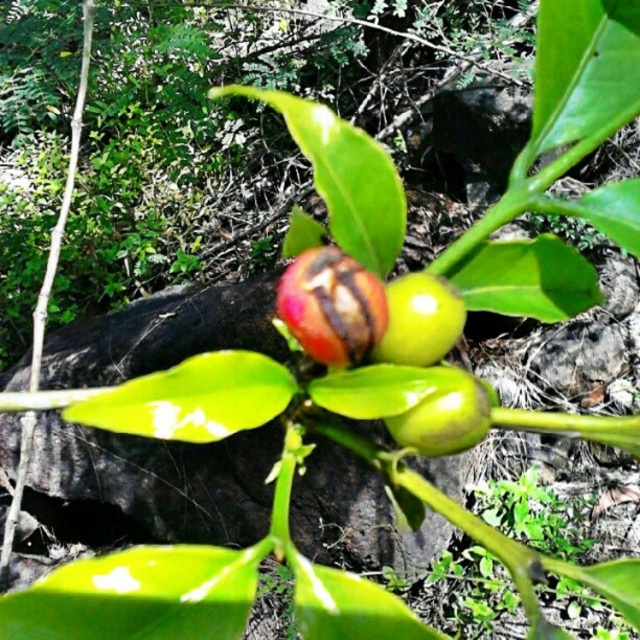
You are a botanist examining the plant and want to collect the shiny red fruit at center and the green glossy fruit at center. Which fruit should you reach for first to avoid blocking your view of the other?

You should reach for the shiny red fruit at center first because it is in front of the green glossy fruit at center, so removing it first will prevent blocking the view of the green glossy fruit at center.

You are a botanist examining two fruits on a plant. You have the green matte fruit at center and the green glossy fruit at center. Which fruit is taller?

The green matte fruit at center is taller than the green glossy fruit at center.